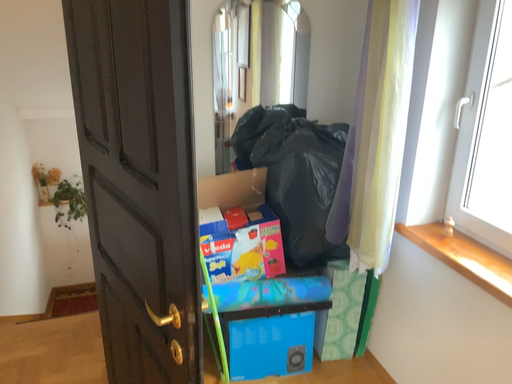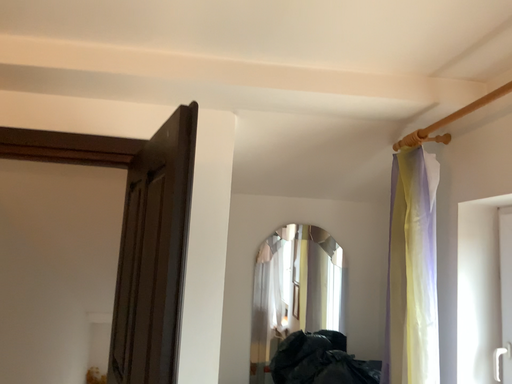
Question: Which way did the camera rotate in the video?

Choices:
 (A) rotated right
 (B) rotated left

Answer: (B)